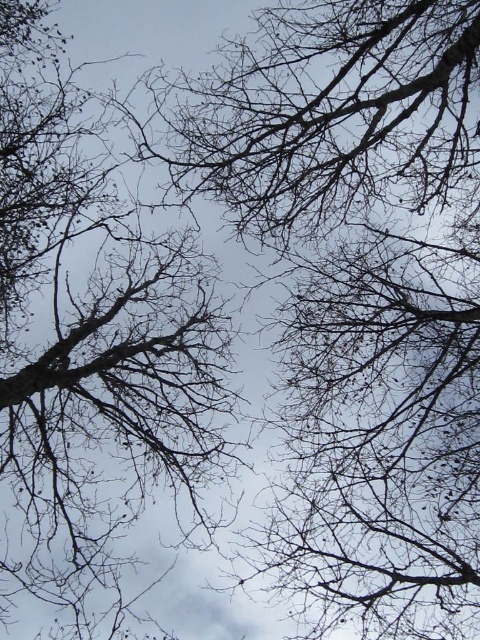
Does bare branches at center have a lesser height compared to dark brown branches at upper center?

No, bare branches at center is not shorter than dark brown branches at upper center.

Between point (55, 403) and point (295, 177), which one is positioned in front?

Point (295, 177)

Where is `bare branches at center`? This screenshot has width=480, height=640. bare branches at center is located at coordinates (93, 339).